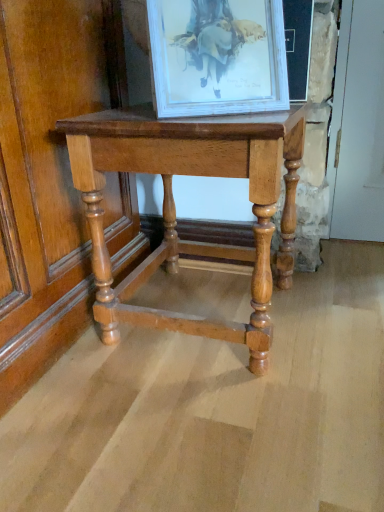
This screenshot has height=512, width=384. Find the location of `free space in front of polished wood table at center`. free space in front of polished wood table at center is located at coordinates (199, 421).